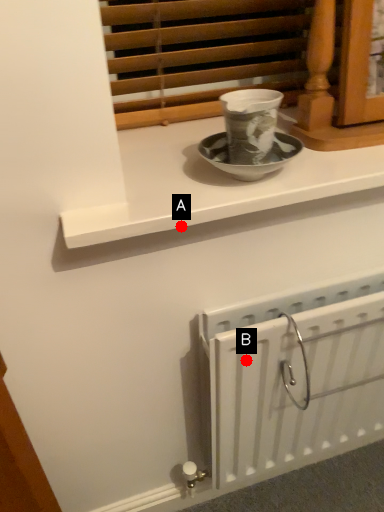
Question: Two points are circled on the image, labeled by A and B beside each circle. Which point is farther from the camera taking this photo?

Choices:
 (A) A is further
 (B) B is further

Answer: (B)